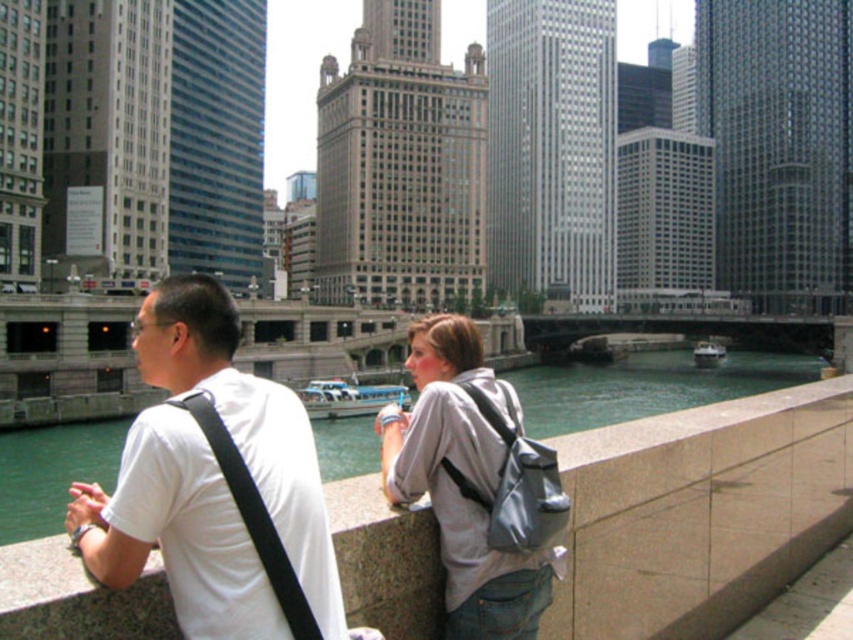
Question: In this image, where is smooth concrete ledge at center located relative to white matte shirt at center?

Choices:
 (A) below
 (B) above

Answer: (A)

Question: Among these points, which one is farthest from the camera?

Choices:
 (A) (126, 595)
 (B) (289, 515)

Answer: (B)

Question: Which point is closer to the camera?

Choices:
 (A) gray fabric backpack at center
 (B) smooth concrete ledge at center

Answer: (B)

Question: Is smooth concrete ledge at center above gray fabric backpack at center?

Choices:
 (A) yes
 (B) no

Answer: (B)

Question: Is smooth concrete ledge at center closer to the viewer compared to white matte shirt at center?

Choices:
 (A) yes
 (B) no

Answer: (A)

Question: Which is farther from the gray fabric backpack at center?

Choices:
 (A) white matte shirt at center
 (B) smooth concrete ledge at center

Answer: (A)